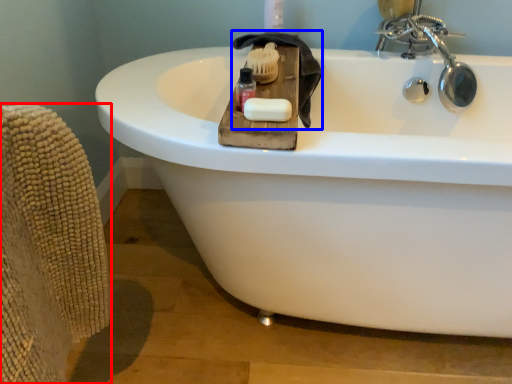
Question: Which point is further to the camera, armchair (highlighted by a red box) or bath towel (highlighted by a blue box)?

Choices:
 (A) armchair
 (B) bath towel

Answer: (B)